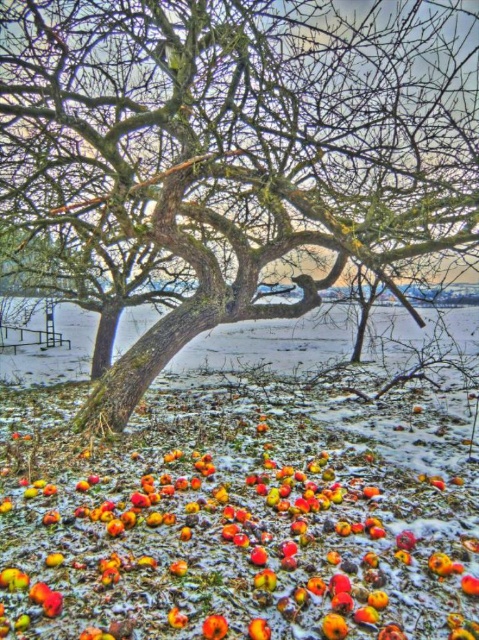
Question: Is rough bark tree at center thinner than shiny red apple at center?

Choices:
 (A) yes
 (B) no

Answer: (B)

Question: Which point appears closest to the camera in this image?

Choices:
 (A) (215, 116)
 (B) (221, 627)

Answer: (B)

Question: In this image, where is rough bark tree at center located relative to shiny red apple at center?

Choices:
 (A) left
 (B) right

Answer: (A)

Question: Which point is farther to the camera?

Choices:
 (A) (223, 627)
 (B) (230, 316)

Answer: (B)

Question: Is rough bark tree at center to the left of shiny red apple at center from the viewer's perspective?

Choices:
 (A) yes
 (B) no

Answer: (A)